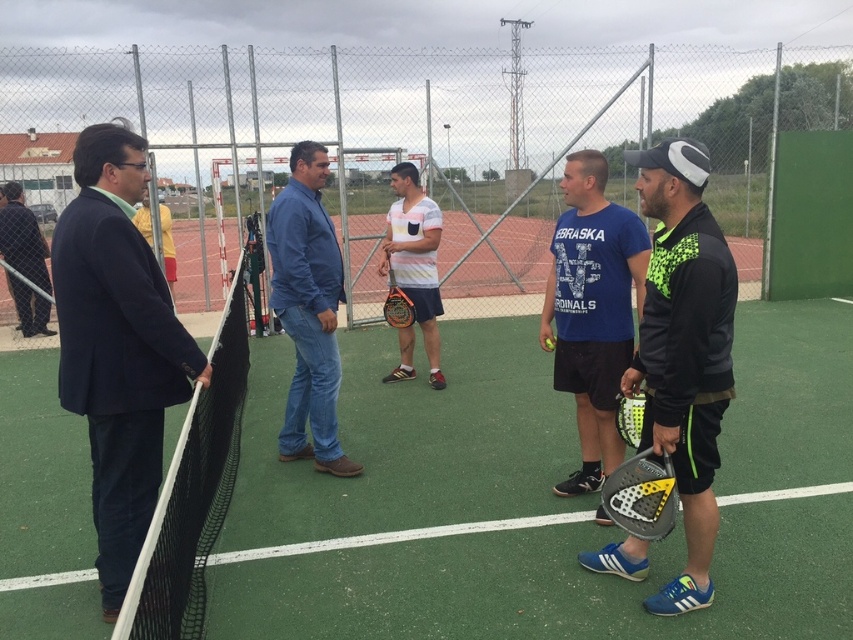
Does dark blue suit at left appear on the left side of yellow-green textured racket at lower right?

Yes, dark blue suit at left is to the left of yellow-green textured racket at lower right.

Can you confirm if dark blue suit at left is wider than yellow-green textured racket at lower right?

Yes, dark blue suit at left is wider than yellow-green textured racket at lower right.

Where is `dark blue suit at left`? The image size is (853, 640). dark blue suit at left is located at coordinates (117, 346).

Between point (428, 352) and point (402, 294), which one is positioned in front?

Point (402, 294)

Locate an element on the screen. white striped shirt at center is located at coordinates (415, 257).

You are a GUI agent. You are given a task and a screenshot of the screen. Output one action in this format:
    pyautogui.click(x=<x>, y=<y>)
    Task: Click on the white striped shirt at center
    
    Given the screenshot: What is the action you would take?
    pyautogui.click(x=415, y=257)

Does yellow-green textured racket at lower right come behind dark gray suit at left?

No, it is not.

Who is more forward, (662, 502) or (33, 300)?

Positioned in front is point (662, 502).

Who is more distant from viewer, (666, 472) or (38, 246)?

The point (38, 246) is more distant.

This screenshot has width=853, height=640. I want to click on yellow-green textured racket at lower right, so click(x=641, y=496).